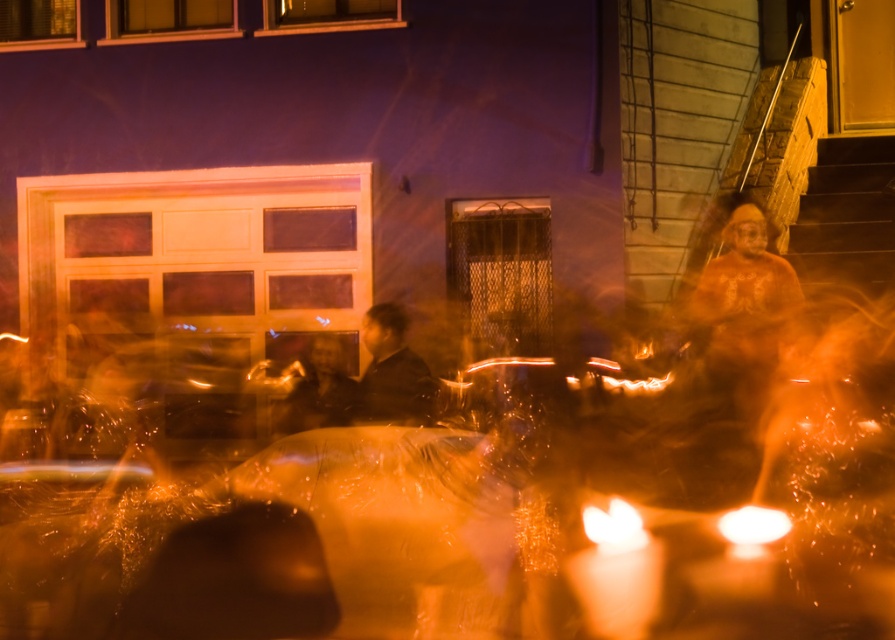
Who is taller, dark brown leather jacket at center or smooth black jacket at center?

dark brown leather jacket at center is taller.

Does dark brown leather jacket at center have a lesser width compared to smooth black jacket at center?

Yes, dark brown leather jacket at center is thinner than smooth black jacket at center.

At what (x,y) coordinates should I click in order to perform the action: click on dark brown leather jacket at center. Please return your answer as a coordinate pair (x, y). The image size is (895, 640). Looking at the image, I should click on (393, 371).

What are the coordinates of `dark brown leather jacket at center` in the screenshot? It's located at (393, 371).

Does point (301, 394) lie in front of point (610, 529)?

No, it is behind (610, 529).

Is smooth black jacket at center positioned in front of orange translucent light at center?

No, smooth black jacket at center is further to the viewer.

Describe the element at coordinates (320, 387) in the screenshot. I see `smooth black jacket at center` at that location.

In order to click on smooth black jacket at center in this screenshot , I will do tap(320, 387).

Is dark brown leather jacket at center positioned at the back of matte orange candle at lower right?

Yes, dark brown leather jacket at center is behind matte orange candle at lower right.

Between dark brown leather jacket at center and matte orange candle at lower right, which one is positioned lower?

Positioned lower is matte orange candle at lower right.

Between point (402, 330) and point (749, 513), which one is positioned behind?

Positioned behind is point (402, 330).

Find the location of a particular element. The height and width of the screenshot is (640, 895). dark brown leather jacket at center is located at coordinates (393, 371).